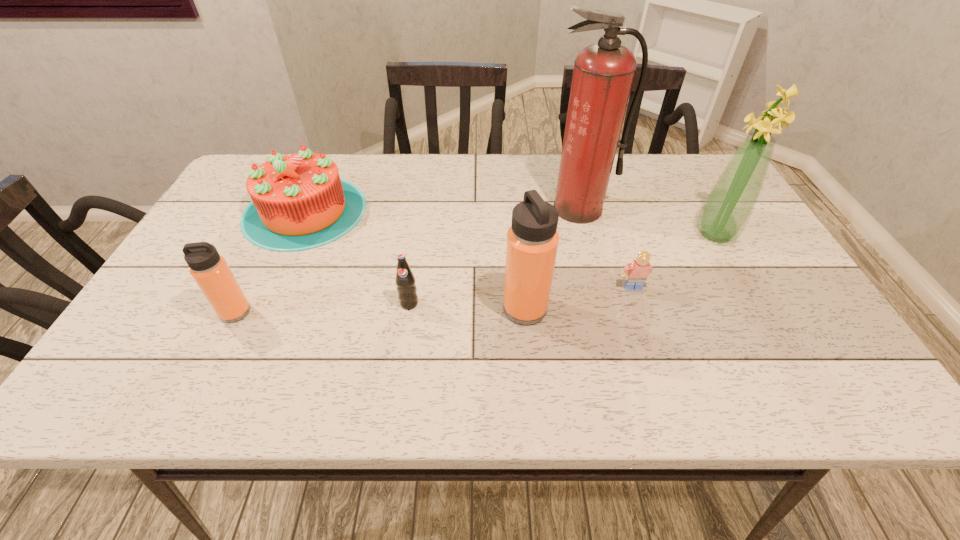
You are a GUI agent. You are given a task and a screenshot of the screen. Output one action in this format:
    pyautogui.click(x=<x>, y=<y>)
    Task: Click on the cake located in the far edge section of the desktop
    The height and width of the screenshot is (540, 960).
    Given the screenshot: What is the action you would take?
    pyautogui.click(x=299, y=202)

Identify the location of fire extinguisher that is positioned at the far edge. Image resolution: width=960 pixels, height=540 pixels. (603, 74).

This screenshot has height=540, width=960. What are the coordinates of `object that is at the near edge` in the screenshot? It's located at (532, 240).

Find the location of a particular element. The width and height of the screenshot is (960, 540). thermos bottle that is at the left edge is located at coordinates pyautogui.click(x=210, y=271).

Identify the location of cake at the left edge. This screenshot has width=960, height=540. (299, 202).

Find the location of a particular element. The width and height of the screenshot is (960, 540). object located in the right edge section of the desktop is located at coordinates (729, 206).

Locate an element on the screen. This screenshot has width=960, height=540. object located at the far left corner is located at coordinates (299, 202).

Locate an element on the screen. free space at the far edge of the desktop is located at coordinates (470, 183).

Locate an element on the screen. vacant region at the near edge of the desktop is located at coordinates (498, 353).

Where is `vacant region at the left edge of the desktop`? This screenshot has width=960, height=540. vacant region at the left edge of the desktop is located at coordinates (192, 300).